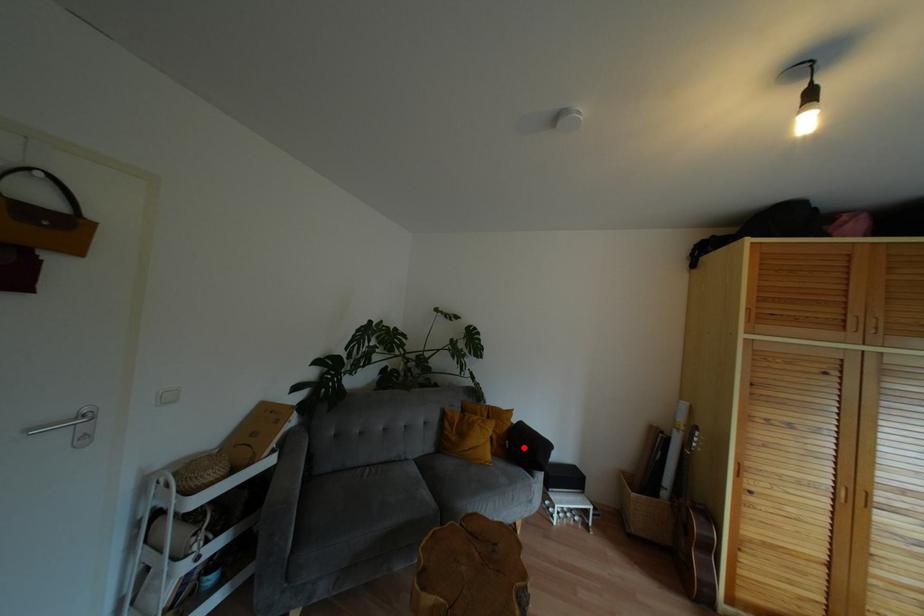
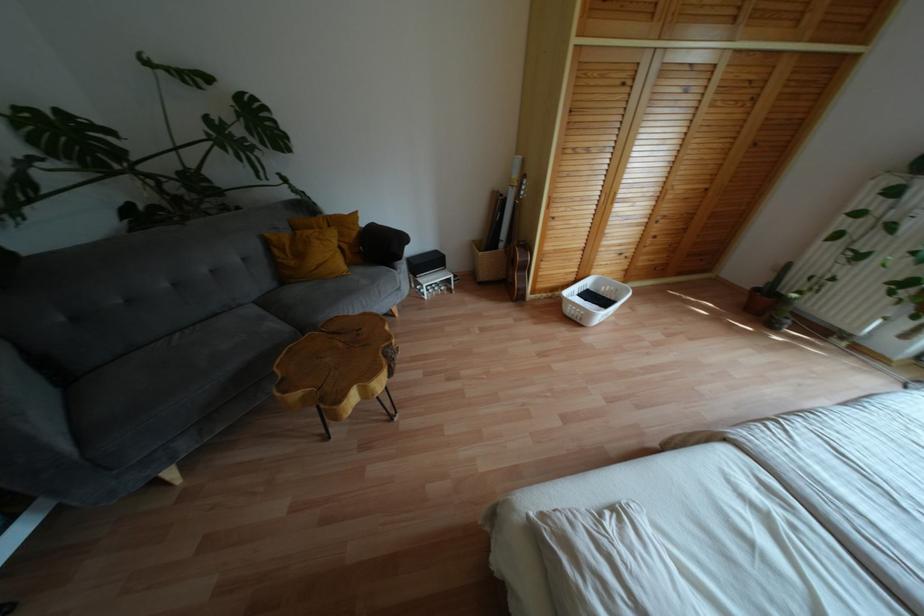
Question: I am providing you with two images of the same scene from different viewpoints. Image1 has a red point marked. In image2, the corresponding 3D location appears at what relative position? Reply with the corresponding letter.

Choices:
 (A) Closer
 (B) Farther

Answer: (A)